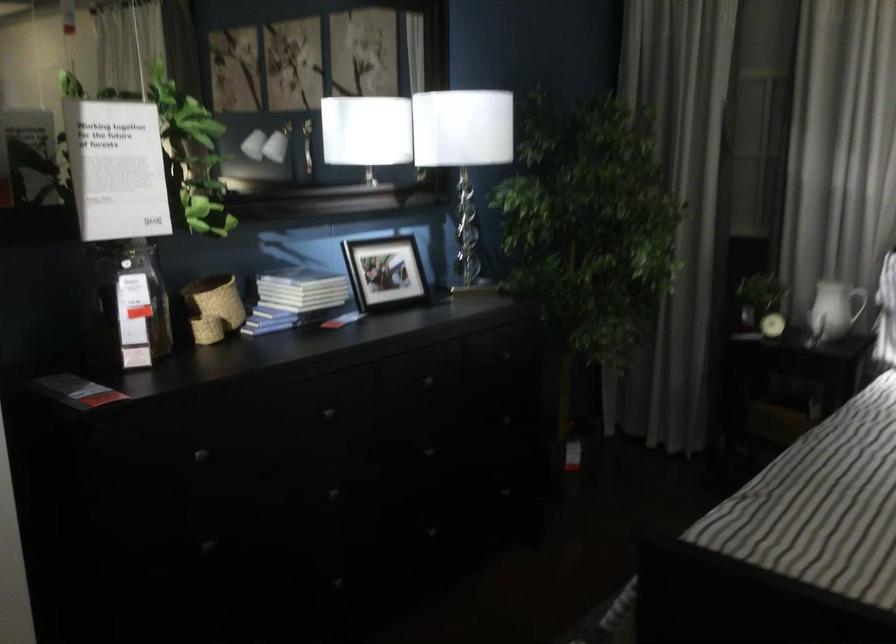
What do you see at coordinates (213, 307) in the screenshot? Image resolution: width=896 pixels, height=644 pixels. I see `a small wicker basket` at bounding box center [213, 307].